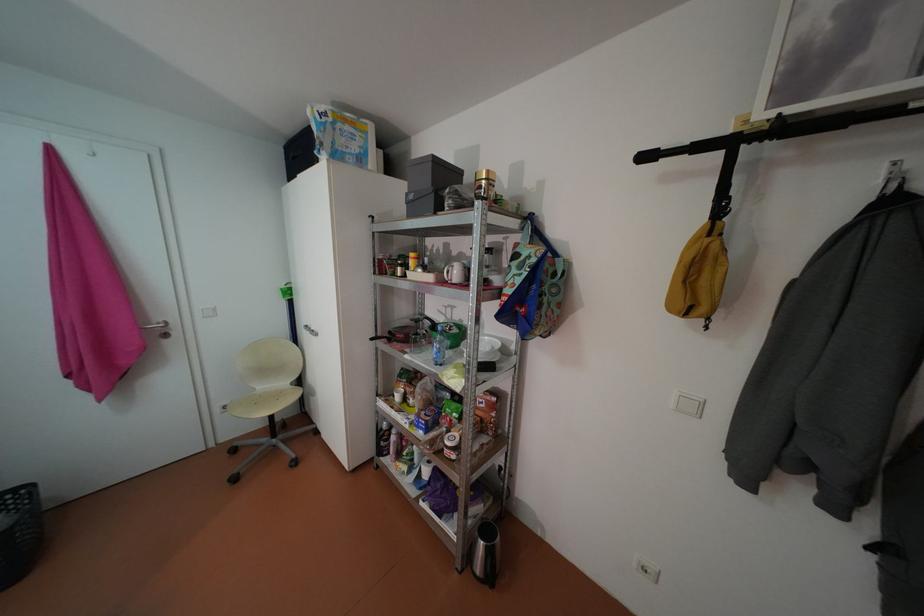
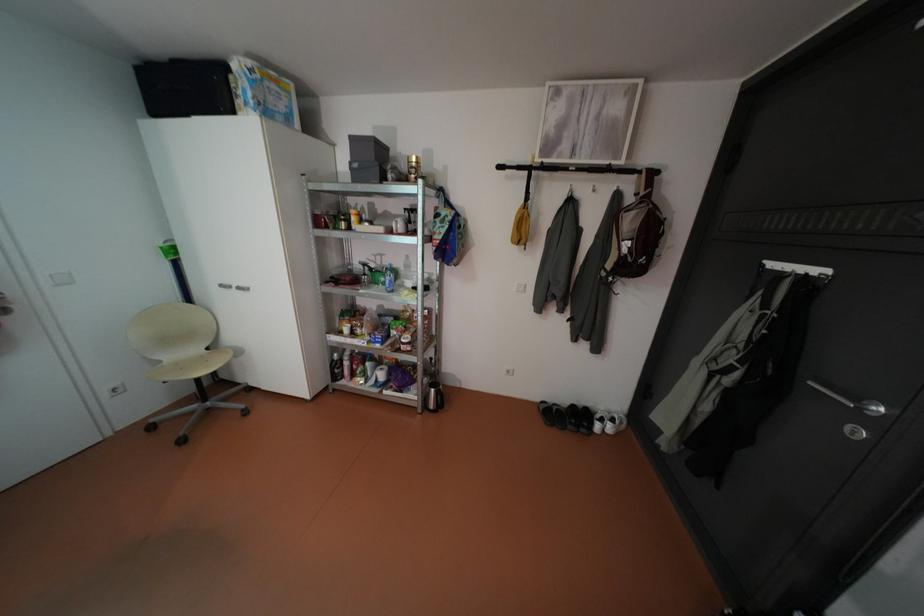
Question: The camera is either moving clockwise (left) or counter-clockwise (right) around the object. The first image is from the beginning of the video and the second image is from the end. Is the camera moving left or right when shooting the video?

Choices:
 (A) Left
 (B) Right

Answer: (A)